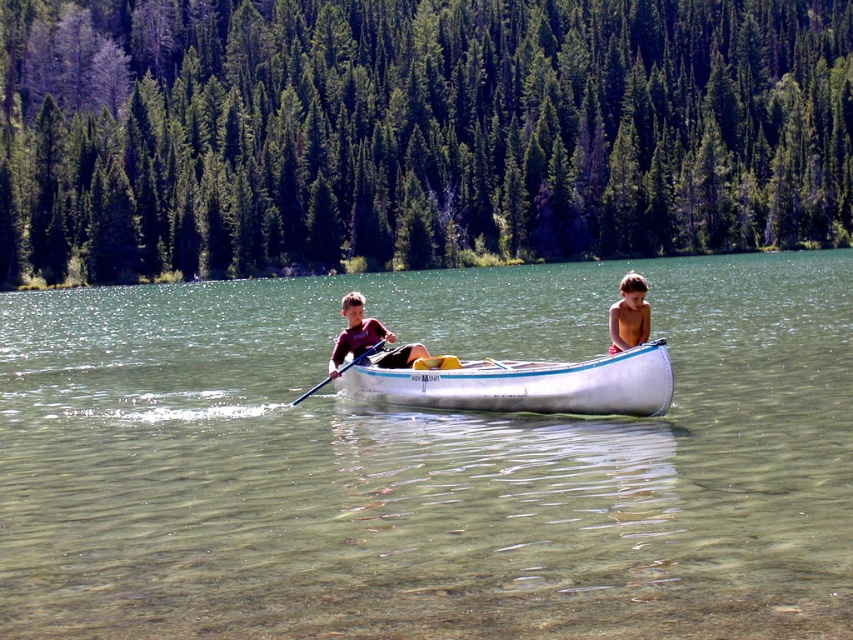
Between clear water at center and wooden polished paddle at center, which one appears on the right side from the viewer's perspective?

Positioned to the right is clear water at center.

Find the location of `clear water at center`. clear water at center is located at coordinates (427, 461).

Which is more to the left, clear water at center or dark red fabric shirt at center?

From the viewer's perspective, dark red fabric shirt at center appears more on the left side.

Does clear water at center come in front of dark red fabric shirt at center?

That is True.

Who is more forward, (659, 611) or (402, 348)?

Point (659, 611) is more forward.

The height and width of the screenshot is (640, 853). What are the coordinates of `clear water at center` in the screenshot? It's located at (427, 461).

Is white polished wood canoe at center shorter than wooden polished paddle at center?

Yes, white polished wood canoe at center is shorter than wooden polished paddle at center.

How much distance is there between white polished wood canoe at center and wooden polished paddle at center?

white polished wood canoe at center is 5.00 meters from wooden polished paddle at center.

Find the location of a particular element. white polished wood canoe at center is located at coordinates (523, 385).

Identify the location of white polished wood canoe at center. (523, 385).